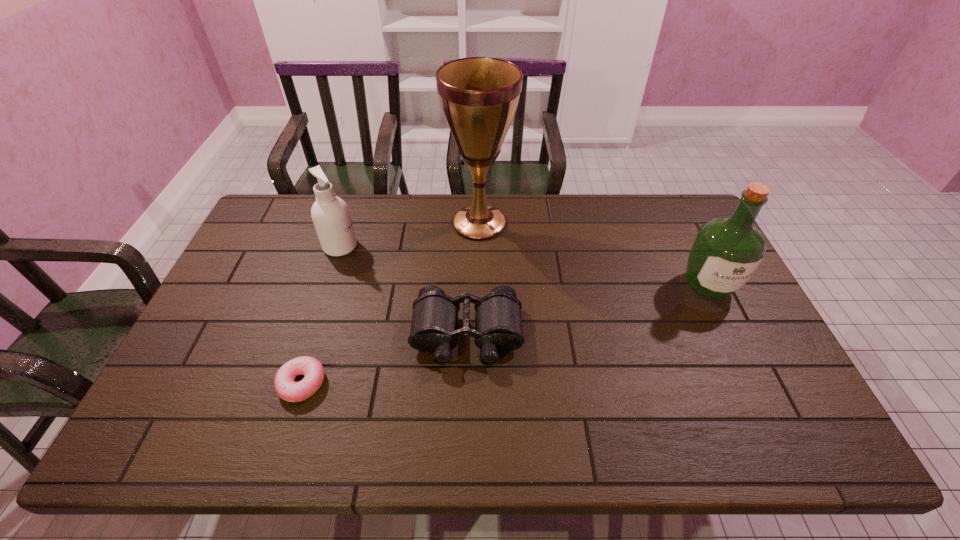
Where is `object that is the second nearest to the liquor`? The image size is (960, 540). object that is the second nearest to the liquor is located at coordinates (479, 96).

The height and width of the screenshot is (540, 960). What are the coordinates of `free spot that satisfies the following two spatial constraints: 1. on the front label of the cleansing agent; 2. on the right side of the shortest object` in the screenshot? It's located at (296, 383).

Identify the location of free space in the image that satisfies the following two spatial constraints: 1. on the back side of the shortest object; 2. on the front label of the cleansing agent. (345, 246).